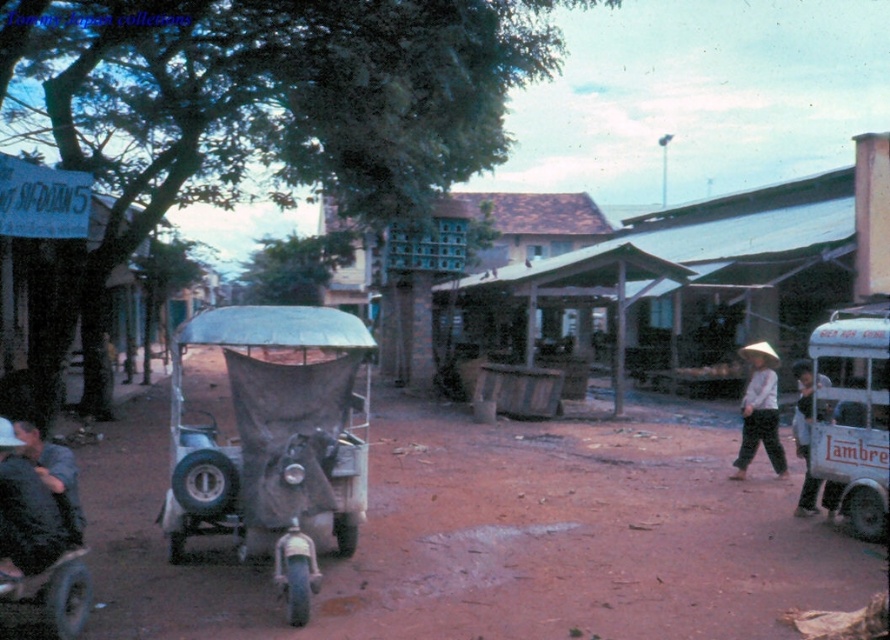
Between brown dirt field at center and dark blue shirt at lower left, which one has more height?

With more height is brown dirt field at center.

Can you confirm if brown dirt field at center is shorter than dark blue shirt at lower left?

No.

Does point (689, 593) lie in front of point (39, 547)?

No, (689, 593) is further to viewer.

You are a GUI agent. You are given a task and a screenshot of the screen. Output one action in this format:
    pyautogui.click(x=<x>, y=<y>)
    Task: Click on the brown dirt field at center
    Image resolution: width=890 pixels, height=640 pixels.
    Given the screenshot: What is the action you would take?
    pyautogui.click(x=490, y=538)

Measure the distance between brown dirt field at center and camera.

6.73 meters

In order to click on brown dirt field at center in this screenshot , I will do `click(490, 538)`.

Where is `brown dirt field at center`? Image resolution: width=890 pixels, height=640 pixels. brown dirt field at center is located at coordinates pos(490,538).

Who is positioned more to the left, brown dirt field at center or wooden hut at center?

From the viewer's perspective, wooden hut at center appears more on the left side.

Is brown dirt field at center taller than wooden hut at center?

In fact, brown dirt field at center may be shorter than wooden hut at center.

Is point (328, 625) closer to viewer compared to point (506, 225)?

That is True.

Find the location of a particular element. brown dirt field at center is located at coordinates (490, 538).